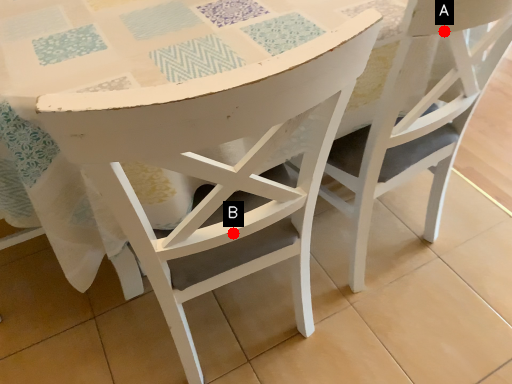
Question: Two points are circled on the image, labeled by A and B beside each circle. Which point is closer to the camera taking this photo?

Choices:
 (A) A is closer
 (B) B is closer

Answer: (A)